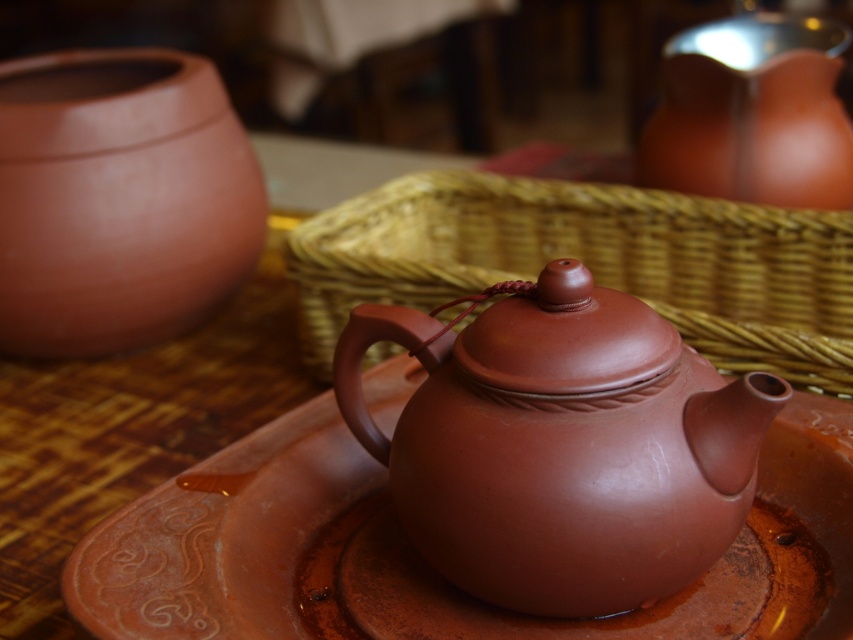
You are a guest at a tea ceremony and see the matte clay teapot at center and the matte wicker basket at center on the tray. Which object is closer to you?

The matte clay teapot at center is closer to you because it is positioned under the matte wicker basket at center, meaning the basket is above it and thus farther away.